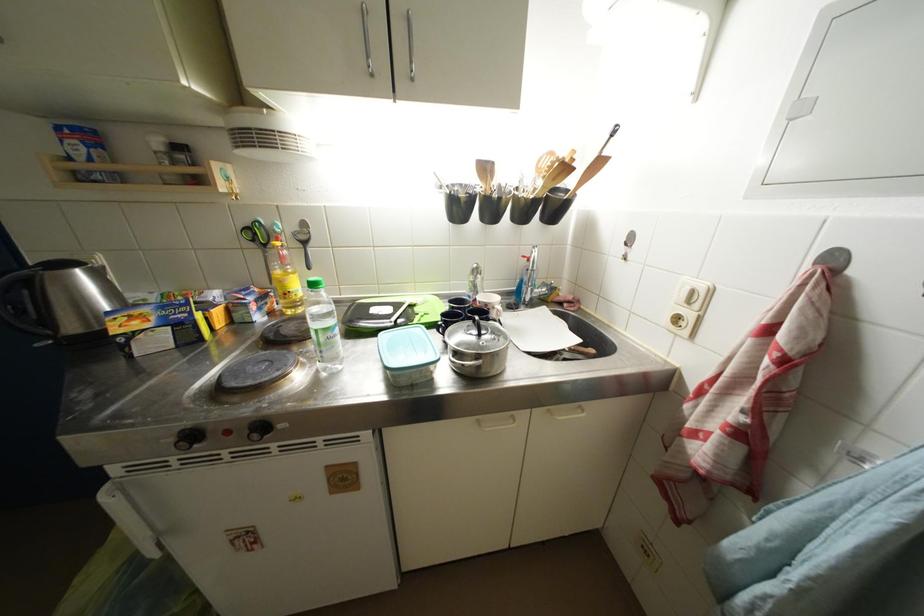
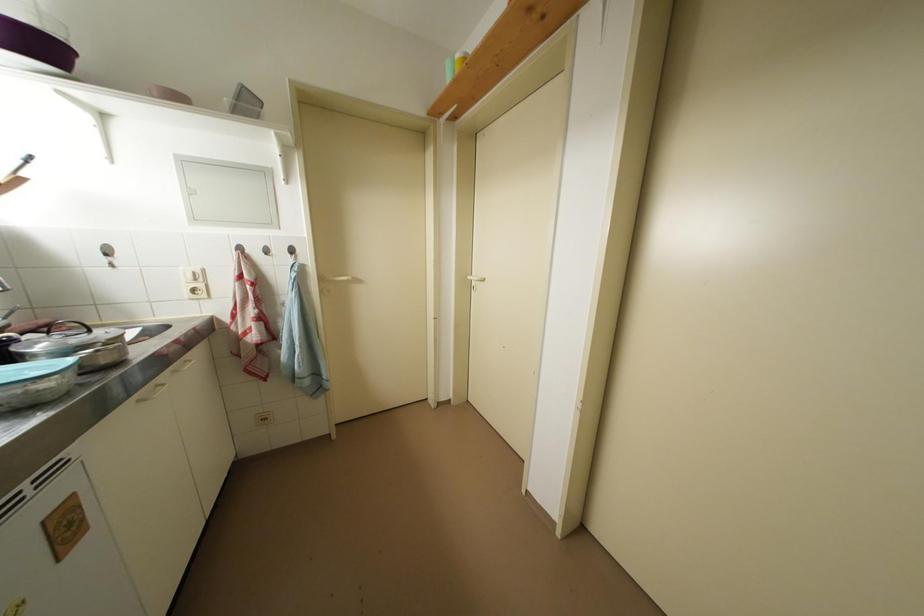
Where in the second image is the point corresponding to the point at 699,296 from the first image?

(201, 277)